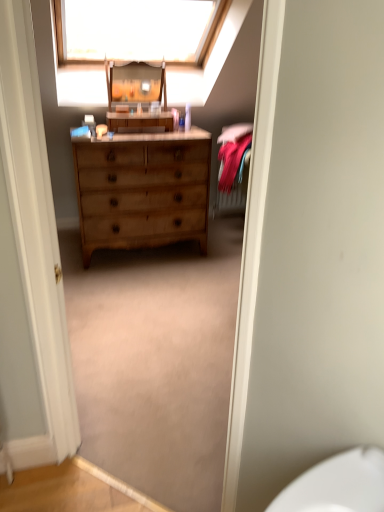
Identify the location of white fabric at upper center. The width and height of the screenshot is (384, 512). (138, 30).

This screenshot has height=512, width=384. Describe the element at coordinates (137, 97) in the screenshot. I see `wooden changing table at center` at that location.

What do you see at coordinates (232, 168) in the screenshot? This screenshot has width=384, height=512. I see `velvet pink bed at right` at bounding box center [232, 168].

The width and height of the screenshot is (384, 512). What do you see at coordinates (139, 121) in the screenshot? I see `wooden dresser at center` at bounding box center [139, 121].

This screenshot has height=512, width=384. What do you see at coordinates (142, 190) in the screenshot?
I see `light brown wood dresser at center` at bounding box center [142, 190].

Locate an element on the screen. The image size is (384, 512). white fabric at upper center is located at coordinates (138, 30).

Which object is closer to the camera, velvet pink bed at right or white fabric at upper center?

white fabric at upper center is closer to the camera.

From a real-world perspective, is velvet pink bed at right under white fabric at upper center?

Yes.

Is velvet pink bed at right spatially inside white fabric at upper center, or outside of it?

velvet pink bed at right lies outside white fabric at upper center.

Which of these two, velvet pink bed at right or white fabric at upper center, is bigger?

white fabric at upper center.

Is light brown wood dresser at center inside the boundaries of wooden dresser at center, or outside?

light brown wood dresser at center lies outside wooden dresser at center.

How many degrees apart are the facing directions of light brown wood dresser at center and wooden dresser at center?

1.05 degrees separate the facing orientations of light brown wood dresser at center and wooden dresser at center.

Is light brown wood dresser at center wider or thinner than wooden dresser at center?

light brown wood dresser at center is wider than wooden dresser at center.

Choose the correct answer: Is wooden changing table at center inside white fabric at upper center or outside it?

wooden changing table at center is not enclosed by white fabric at upper center.

From a real-world perspective, is wooden changing table at center positioned above or below white fabric at upper center?

wooden changing table at center is below white fabric at upper center.

From the image's perspective, which is above, wooden changing table at center or white fabric at upper center?

white fabric at upper center is shown above in the image.

The image size is (384, 512). Find the location of `changing table that appears below the white fabric at upper center (from a real-world perspective)`. changing table that appears below the white fabric at upper center (from a real-world perspective) is located at coordinates (137, 97).

Where is `changing table on the left of velvet pink bed at right`? changing table on the left of velvet pink bed at right is located at coordinates (137, 97).

Is wooden changing table at center shorter than velvet pink bed at right?

Yes.

Is wooden changing table at center oriented towards velvet pink bed at right?

No, wooden changing table at center is not turned towards velvet pink bed at right.

Considering the positions of objects wooden changing table at center and velvet pink bed at right in the image provided, who is in front, wooden changing table at center or velvet pink bed at right?

wooden changing table at center is closer to the camera.

Choose the correct answer: Is wooden changing table at center inside light brown wood dresser at center or outside it?

wooden changing table at center cannot be found inside light brown wood dresser at center.

Is wooden changing table at center looking in the opposite direction of light brown wood dresser at center?

No, light brown wood dresser at center is not at the back of wooden changing table at center.

Is the depth of wooden changing table at center less than that of light brown wood dresser at center?

That is False.

Between point (128, 125) and point (172, 210), which one is positioned behind?

The point (172, 210) is behind.

Considering the sizes of wooden dresser at center and velvet pink bed at right in the image, is wooden dresser at center bigger or smaller than velvet pink bed at right?

Clearly, wooden dresser at center is smaller in size than velvet pink bed at right.

Considering the points (108, 116) and (233, 192), which point is behind, point (108, 116) or point (233, 192)?

The point (233, 192) is farther.

Considering the relative sizes of wooden dresser at center and velvet pink bed at right in the image provided, is wooden dresser at center shorter than velvet pink bed at right?

Yes, wooden dresser at center is shorter than velvet pink bed at right.

Can you confirm if light brown wood dresser at center is shorter than wooden changing table at center?

In fact, light brown wood dresser at center may be taller than wooden changing table at center.

From the image's perspective, is light brown wood dresser at center above wooden changing table at center?

Incorrect, from the image's perspective, light brown wood dresser at center is lower than wooden changing table at center.

From a real-world perspective, is light brown wood dresser at center physically located above or below wooden changing table at center?

light brown wood dresser at center is situated lower than wooden changing table at center in the real world.

Can you tell me how much light brown wood dresser at center and wooden changing table at center differ in facing direction?

The angular difference between light brown wood dresser at center and wooden changing table at center is 0.774 degrees.

Identify the location of window that is in front of the velvet pink bed at right. The image size is (384, 512). point(138,30).

Where is `cabinetry on the right side of light brown wood dresser at center`? The image size is (384, 512). cabinetry on the right side of light brown wood dresser at center is located at coordinates (139, 121).

Which object lies nearer to the anchor point white fabric at upper center, wooden dresser at center or wooden changing table at center?

Based on the image, wooden changing table at center appears to be nearer to white fabric at upper center.

Based on their spatial positions, is wooden changing table at center or light brown wood dresser at center further from wooden dresser at center?

The object further to wooden dresser at center is light brown wood dresser at center.

From the image, which object appears to be farther from wooden changing table at center, wooden dresser at center or velvet pink bed at right?

Among the two, velvet pink bed at right is located further to wooden changing table at center.

When comparing their distances from light brown wood dresser at center, does velvet pink bed at right or white fabric at upper center seem further?

white fabric at upper center lies further to light brown wood dresser at center than the other object.

Which object lies nearer to the anchor point wooden dresser at center, light brown wood dresser at center or velvet pink bed at right?

The object closer to wooden dresser at center is light brown wood dresser at center.

Which object lies nearer to the anchor point velvet pink bed at right, white fabric at upper center or light brown wood dresser at center?

light brown wood dresser at center lies closer to velvet pink bed at right than the other object.

When comparing their distances from white fabric at upper center, does light brown wood dresser at center or wooden dresser at center seem further?

light brown wood dresser at center lies further to white fabric at upper center than the other object.

Considering their positions, is velvet pink bed at right positioned closer to white fabric at upper center than light brown wood dresser at center?

Among the two, light brown wood dresser at center is located nearer to white fabric at upper center.

Where is `changing table located between white fabric at upper center and wooden dresser at center in the depth direction`? The image size is (384, 512). changing table located between white fabric at upper center and wooden dresser at center in the depth direction is located at coordinates pyautogui.click(x=137, y=97).

This screenshot has width=384, height=512. What are the coordinates of `cabinetry located between wooden changing table at center and velvet pink bed at right in the left-right direction` in the screenshot? It's located at pos(139,121).

Identify the location of cabinetry located between light brown wood dresser at center and velvet pink bed at right in the left-right direction. pyautogui.click(x=139, y=121).

You are a GUI agent. You are given a task and a screenshot of the screen. Output one action in this format:
    pyautogui.click(x=<x>, y=<y>)
    Task: Click on the changing table between white fabric at upper center and velvet pink bed at right in the front-back direction
    This screenshot has width=384, height=512.
    Given the screenshot: What is the action you would take?
    pyautogui.click(x=137, y=97)